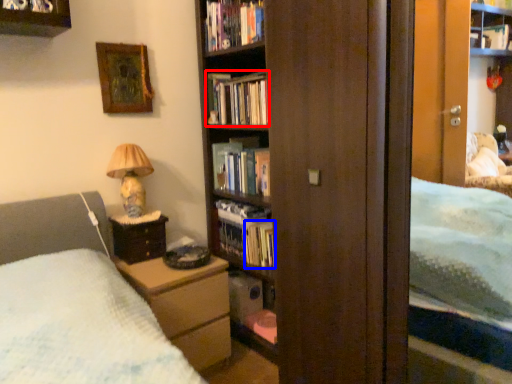
Question: Which of the following is the farthest to the observer, book (highlighted by a red box) or book (highlighted by a blue box)?

Choices:
 (A) book
 (B) book

Answer: (A)